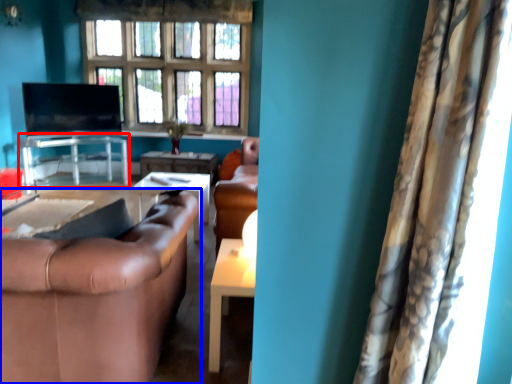
Question: Among these objects, which one is farthest to the camera, table (highlighted by a red box) or studio couch (highlighted by a blue box)?

Choices:
 (A) table
 (B) studio couch

Answer: (A)